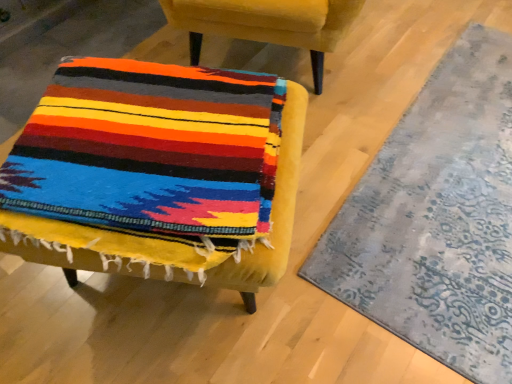
The height and width of the screenshot is (384, 512). Describe the element at coordinates (157, 169) in the screenshot. I see `velvet yellow chair at center, arranged as the second chair when viewed from the top` at that location.

At what (x,y) coordinates should I click in order to perform the action: click on textured gray rug at lower right. Please return your answer as a coordinate pair (x, y). Looking at the image, I should click on (437, 218).

Relative to velvet yellow chair at center, marked as the 1th chair in a bottom-to-top arrangement, is velvet yellow chair at lower left, which is the first chair in top-to-bottom order, in front or behind?

In the image, velvet yellow chair at lower left, which is the first chair in top-to-bottom order, appears behind velvet yellow chair at center, marked as the 1th chair in a bottom-to-top arrangement.

In terms of height, does velvet yellow chair at lower left, the 2th chair in the bottom-to-top sequence, look taller or shorter compared to velvet yellow chair at center, marked as the 1th chair in a bottom-to-top arrangement?

velvet yellow chair at lower left, the 2th chair in the bottom-to-top sequence, is taller than velvet yellow chair at center, marked as the 1th chair in a bottom-to-top arrangement.

From a real-world perspective, is velvet yellow chair at lower left, the 2th chair in the bottom-to-top sequence, under velvet yellow chair at center, arranged as the second chair when viewed from the top?

No.

How different are the orientations of velvet yellow chair at lower left, the 2th chair in the bottom-to-top sequence, and velvet yellow chair at center, arranged as the second chair when viewed from the top, in degrees?

There is a 94.7-degree angle between the facing directions of velvet yellow chair at lower left, the 2th chair in the bottom-to-top sequence, and velvet yellow chair at center, arranged as the second chair when viewed from the top.

Looking at this image, considering the sizes of velvet yellow chair at lower left, which is the first chair in top-to-bottom order, and textured gray rug at lower right in the image, is velvet yellow chair at lower left, which is the first chair in top-to-bottom order, wider or thinner than textured gray rug at lower right?

In the image, velvet yellow chair at lower left, which is the first chair in top-to-bottom order, appears to be wider than textured gray rug at lower right.

Is velvet yellow chair at lower left, the 2th chair in the bottom-to-top sequence, further to the viewer compared to textured gray rug at lower right?

That is True.

Are velvet yellow chair at lower left, the 2th chair in the bottom-to-top sequence, and textured gray rug at lower right far apart?

No, velvet yellow chair at lower left, the 2th chair in the bottom-to-top sequence, is in close proximity to textured gray rug at lower right.

Is velvet yellow chair at lower left, the 2th chair in the bottom-to-top sequence, oriented towards textured gray rug at lower right?

No, velvet yellow chair at lower left, the 2th chair in the bottom-to-top sequence, is not facing towards textured gray rug at lower right.

Would you say textured gray rug at lower right is to the left or to the right of velvet yellow chair at lower left, the 2th chair in the bottom-to-top sequence, in the picture?

textured gray rug at lower right is to the right of velvet yellow chair at lower left, the 2th chair in the bottom-to-top sequence.

From the picture: Considering the sizes of textured gray rug at lower right and velvet yellow chair at lower left, which is the first chair in top-to-bottom order, in the image, is textured gray rug at lower right bigger or smaller than velvet yellow chair at lower left, which is the first chair in top-to-bottom order,?

Considering their sizes, textured gray rug at lower right takes up less space than velvet yellow chair at lower left, which is the first chair in top-to-bottom order.

Is point (508, 203) less distant than point (300, 20)?

Yes, point (508, 203) is in front of point (300, 20).

Is textured gray rug at lower right located outside velvet yellow chair at lower left, the 2th chair in the bottom-to-top sequence?

That's correct, textured gray rug at lower right is outside of velvet yellow chair at lower left, the 2th chair in the bottom-to-top sequence.

Measure the distance between velvet yellow chair at center, arranged as the second chair when viewed from the top, and velvet yellow chair at lower left, the 2th chair in the bottom-to-top sequence.

A distance of 29.52 inches exists between velvet yellow chair at center, arranged as the second chair when viewed from the top, and velvet yellow chair at lower left, the 2th chair in the bottom-to-top sequence.

Does velvet yellow chair at center, arranged as the second chair when viewed from the top, appear on the left side of velvet yellow chair at lower left, which is the first chair in top-to-bottom order?

Correct, you'll find velvet yellow chair at center, arranged as the second chair when viewed from the top, to the left of velvet yellow chair at lower left, which is the first chair in top-to-bottom order.

Can you tell me how much velvet yellow chair at center, marked as the 1th chair in a bottom-to-top arrangement, and velvet yellow chair at lower left, which is the first chair in top-to-bottom order, differ in facing direction?

94.7 degrees.

Considering the relative sizes of velvet yellow chair at center, arranged as the second chair when viewed from the top, and velvet yellow chair at lower left, which is the first chair in top-to-bottom order, in the image provided, is velvet yellow chair at center, arranged as the second chair when viewed from the top, thinner than velvet yellow chair at lower left, which is the first chair in top-to-bottom order,?

Yes, velvet yellow chair at center, arranged as the second chair when viewed from the top, is thinner than velvet yellow chair at lower left, which is the first chair in top-to-bottom order.

Is textured gray rug at lower right oriented towards velvet yellow chair at center, marked as the 1th chair in a bottom-to-top arrangement?

No, textured gray rug at lower right is not aimed at velvet yellow chair at center, marked as the 1th chair in a bottom-to-top arrangement.

Identify the location of chair in front of the textured gray rug at lower right. (157, 169).

Is point (457, 296) in front of point (263, 151)?

No, it is not.

From a real-world perspective, is velvet yellow chair at center, arranged as the second chair when viewed from the top, physically below textured gray rug at lower right?

No.

Based on the photo, considering the sizes of velvet yellow chair at center, marked as the 1th chair in a bottom-to-top arrangement, and textured gray rug at lower right in the image, is velvet yellow chair at center, marked as the 1th chair in a bottom-to-top arrangement, taller or shorter than textured gray rug at lower right?

In the image, velvet yellow chair at center, marked as the 1th chair in a bottom-to-top arrangement, appears to be taller than textured gray rug at lower right.

From the image's perspective, which is below, velvet yellow chair at center, arranged as the second chair when viewed from the top, or textured gray rug at lower right?

velvet yellow chair at center, arranged as the second chair when viewed from the top, appears lower in the image.

Starting from the textured gray rug at lower right, which chair is the 2nd one to the left? Please provide its 2D coordinates.

[(157, 169)]

At what (x,y) coordinates should I click in order to perform the action: click on chair that is on the left side of velvet yellow chair at lower left, which is the first chair in top-to-bottom order. Please return your answer as a coordinate pair (x, y). The image size is (512, 384). Looking at the image, I should click on (157, 169).

Find the location of a particular element. chair lying behind the textured gray rug at lower right is located at coordinates (267, 24).

Considering their positions, is velvet yellow chair at lower left, the 2th chair in the bottom-to-top sequence, positioned closer to velvet yellow chair at center, marked as the 1th chair in a bottom-to-top arrangement, than textured gray rug at lower right?

Among the two, textured gray rug at lower right is located nearer to velvet yellow chair at center, marked as the 1th chair in a bottom-to-top arrangement.

Considering their positions, is textured gray rug at lower right positioned further to velvet yellow chair at lower left, which is the first chair in top-to-bottom order, than velvet yellow chair at center, marked as the 1th chair in a bottom-to-top arrangement?

velvet yellow chair at center, marked as the 1th chair in a bottom-to-top arrangement.

Which object lies nearer to the anchor point textured gray rug at lower right, velvet yellow chair at center, marked as the 1th chair in a bottom-to-top arrangement, or velvet yellow chair at lower left, the 2th chair in the bottom-to-top sequence?

velvet yellow chair at center, marked as the 1th chair in a bottom-to-top arrangement.

From the image, which object appears to be farther from velvet yellow chair at center, marked as the 1th chair in a bottom-to-top arrangement, textured gray rug at lower right or velvet yellow chair at lower left, which is the first chair in top-to-bottom order?

Among the two, velvet yellow chair at lower left, which is the first chair in top-to-bottom order, is located further to velvet yellow chair at center, marked as the 1th chair in a bottom-to-top arrangement.

Based on the photo, which object lies nearer to the anchor point textured gray rug at lower right, velvet yellow chair at lower left, the 2th chair in the bottom-to-top sequence, or velvet yellow chair at center, marked as the 1th chair in a bottom-to-top arrangement?

Based on the image, velvet yellow chair at center, marked as the 1th chair in a bottom-to-top arrangement, appears to be nearer to textured gray rug at lower right.

Considering their positions, is velvet yellow chair at center, arranged as the second chair when viewed from the top, positioned further to velvet yellow chair at lower left, the 2th chair in the bottom-to-top sequence, than textured gray rug at lower right?

velvet yellow chair at center, arranged as the second chair when viewed from the top, is further to velvet yellow chair at lower left, the 2th chair in the bottom-to-top sequence.

Identify the location of chair between velvet yellow chair at center, arranged as the second chair when viewed from the top, and textured gray rug at lower right from left to right. The width and height of the screenshot is (512, 384). (267, 24).